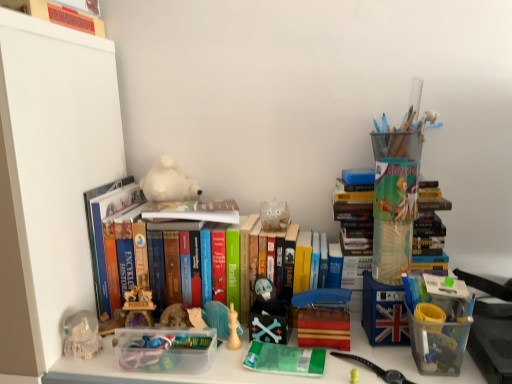
Question: From the image's perspective, does white plush bear at center, the 1th toy from the left, appear lower than hardcover book at center, the second book positioned from the bottom?

Choices:
 (A) no
 (B) yes

Answer: (A)

Question: Is white plush bear at center, which is counted as the second toy, starting from the front, placed right next to hardcover book at center, the 2th book viewed from the top?

Choices:
 (A) no
 (B) yes

Answer: (B)

Question: Can we say white plush bear at center, the 2th toy from the right, lies outside hardcover book at center, the second book positioned from the bottom?

Choices:
 (A) yes
 (B) no

Answer: (A)

Question: Is white plush bear at center, the 2th toy from the right, oriented away from hardcover book at center, the second book positioned from the bottom?

Choices:
 (A) no
 (B) yes

Answer: (A)

Question: From the image's perspective, is white plush bear at center, the 2th toy from the right, over hardcover book at center, the 2th book viewed from the top?

Choices:
 (A) no
 (B) yes

Answer: (B)

Question: From the image's perspective, relative to matte black skull at center, positioned as the 2th toy in top-to-bottom order, is matte red monopoly board game at upper left, placed as the 3th book when sorted from bottom to top, above or below?

Choices:
 (A) above
 (B) below

Answer: (A)

Question: Does point (45, 11) appear closer or farther from the camera than point (266, 284)?

Choices:
 (A) farther
 (B) closer

Answer: (B)

Question: Would you say matte red monopoly board game at upper left, placed as the 3th book when sorted from bottom to top, is to the left or to the right of matte black skull at center, which is the first toy from right to left, in the picture?

Choices:
 (A) right
 (B) left

Answer: (B)

Question: Looking at their shapes, would you say matte red monopoly board game at upper left, placed as the 3th book when sorted from bottom to top, is wider or thinner than matte black skull at center, positioned as the 2th toy in top-to-bottom order?

Choices:
 (A) wide
 (B) thin

Answer: (A)

Question: Is matte red monopoly board game at upper left, which ranks as the first book in top-to-bottom order, inside the boundaries of hardcover book at center, the second book positioned from the bottom, or outside?

Choices:
 (A) outside
 (B) inside

Answer: (A)

Question: Considering the relative positions of matte red monopoly board game at upper left, placed as the 3th book when sorted from bottom to top, and hardcover book at center, the 2th book viewed from the top, in the image provided, is matte red monopoly board game at upper left, placed as the 3th book when sorted from bottom to top, to the left or to the right of hardcover book at center, the 2th book viewed from the top,?

Choices:
 (A) left
 (B) right

Answer: (A)

Question: Is matte red monopoly board game at upper left, which ranks as the first book in top-to-bottom order, wider or thinner than hardcover book at center, the 2th book viewed from the top?

Choices:
 (A) wide
 (B) thin

Answer: (A)

Question: Is point (90, 19) positioned closer to the camera than point (147, 205)?

Choices:
 (A) farther
 (B) closer

Answer: (A)

Question: In the image, is hardcover books at center, which is counted as the third book, starting from the top, on the left side or the right side of white plush bear at center, the 2th toy from the right?

Choices:
 (A) right
 (B) left

Answer: (A)

Question: Is hardcover books at center, which is counted as the third book, starting from the top, in front of or behind white plush bear at center, acting as the second toy starting from the bottom, in the image?

Choices:
 (A) behind
 (B) front

Answer: (B)